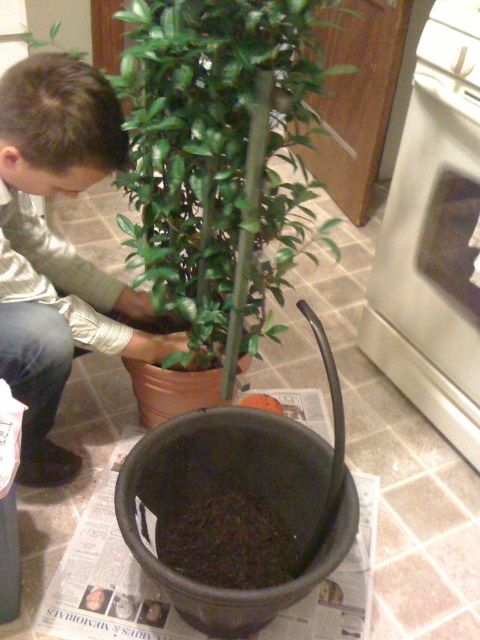
Does matte green plant at center have a lesser height compared to white glossy oven at right?

Yes, matte green plant at center is shorter than white glossy oven at right.

Who is positioned more to the right, matte green plant at center or white glossy oven at right?

white glossy oven at right is more to the right.

At what (x,y) coordinates should I click in order to perform the action: click on matte green plant at center. Please return your answer as a coordinate pair (x, y). The height and width of the screenshot is (640, 480). Looking at the image, I should click on (59, 250).

Is green matte plant at center above white glossy oven at right?

Yes.

Which is behind, point (170, 292) or point (446, 360)?

The point (446, 360) is more distant.

The height and width of the screenshot is (640, 480). What are the coordinates of `green matte plant at center` in the screenshot? It's located at (218, 157).

Is point (186, 259) positioned after point (24, 179)?

Yes, it is behind point (24, 179).

Measure the distance between green matte plant at center and camera.

green matte plant at center and camera are 35.04 inches apart.

Describe the element at coordinates (218, 157) in the screenshot. The width and height of the screenshot is (480, 640). I see `green matte plant at center` at that location.

Where is `green matte plant at center`? green matte plant at center is located at coordinates pyautogui.click(x=218, y=157).